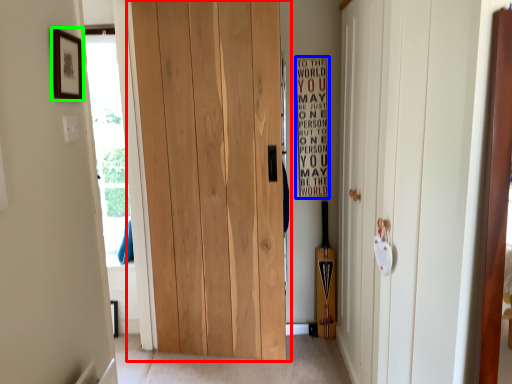
Question: Based on their relative distances, which object is farther from door (highlighted by a red box)? Choose from bulletin board (highlighted by a blue box) and picture frame (highlighted by a green box).

Choices:
 (A) bulletin board
 (B) picture frame

Answer: (B)